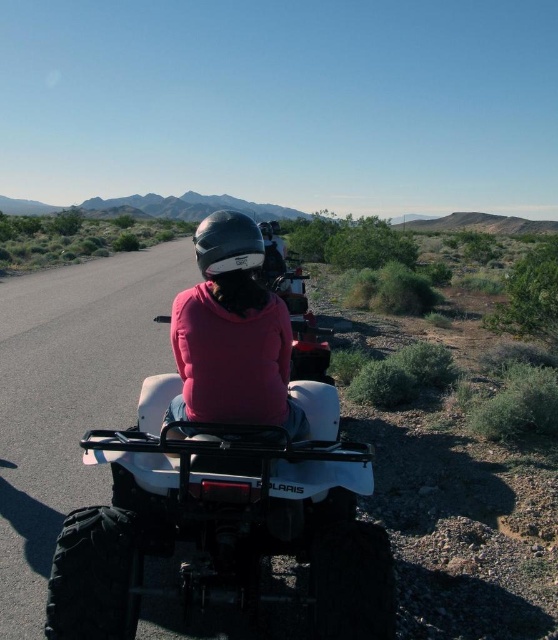
Find the location of a particular element. pink matte helmet at center is located at coordinates (233, 333).

Who is positioned more to the left, pink matte helmet at center or glossy black helmet at center?

glossy black helmet at center is more to the left.

What do you see at coordinates (233, 333) in the screenshot?
I see `pink matte helmet at center` at bounding box center [233, 333].

Where is `pink matte helmet at center`? Image resolution: width=558 pixels, height=640 pixels. pink matte helmet at center is located at coordinates (233, 333).